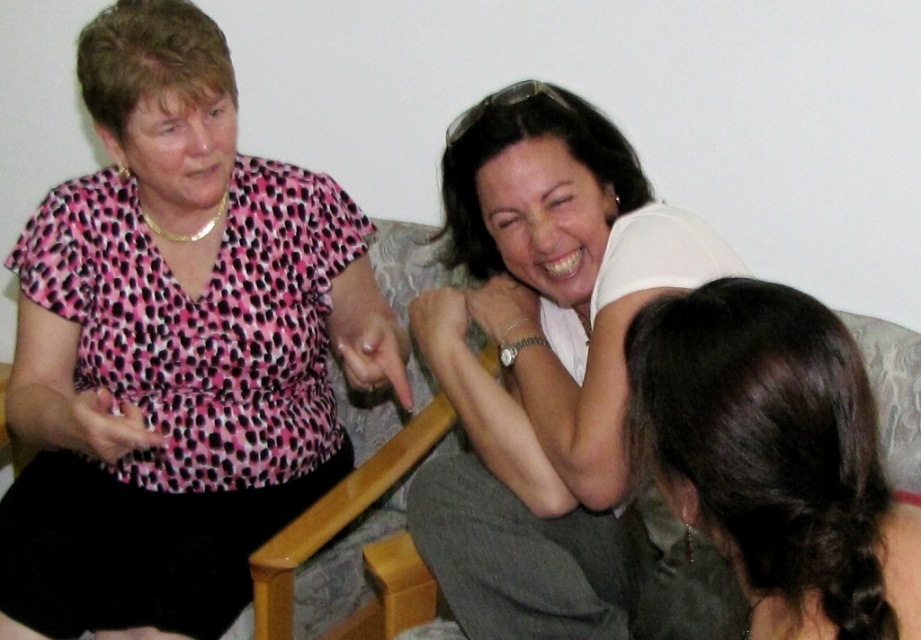
Who is taller, pink dotted blouse at left or dark brown hair at center?

With more height is pink dotted blouse at left.

Does pink dotted blouse at left appear on the left side of dark brown hair at center?

Indeed, pink dotted blouse at left is positioned on the left side of dark brown hair at center.

At what (x,y) coordinates should I click in order to perform the action: click on pink dotted blouse at left. Please return your answer as a coordinate pair (x, y). The width and height of the screenshot is (921, 640). Looking at the image, I should click on (175, 348).

Between dark brown hair at center and patterned fabric couch at center, which one is positioned lower?

patterned fabric couch at center is lower down.

Who is more distant from viewer, (822, 481) or (421, 579)?

Point (421, 579)

You are a GUI agent. You are given a task and a screenshot of the screen. Output one action in this format:
    pyautogui.click(x=<x>, y=<y>)
    Task: Click on the dark brown hair at center
    The image size is (921, 640).
    Given the screenshot: What is the action you would take?
    pyautogui.click(x=776, y=458)

Is pink dotted blouse at left above patterned fabric couch at center?

Correct, pink dotted blouse at left is located above patterned fabric couch at center.

Between pink dotted blouse at left and patterned fabric couch at center, which one has less height?

patterned fabric couch at center

Which is behind, point (248, 552) or point (281, 541)?

The point (248, 552) is behind.

At what (x,y) coordinates should I click in order to perform the action: click on pink dotted blouse at left. Please return your answer as a coordinate pair (x, y). This screenshot has width=921, height=640. Looking at the image, I should click on (175, 348).